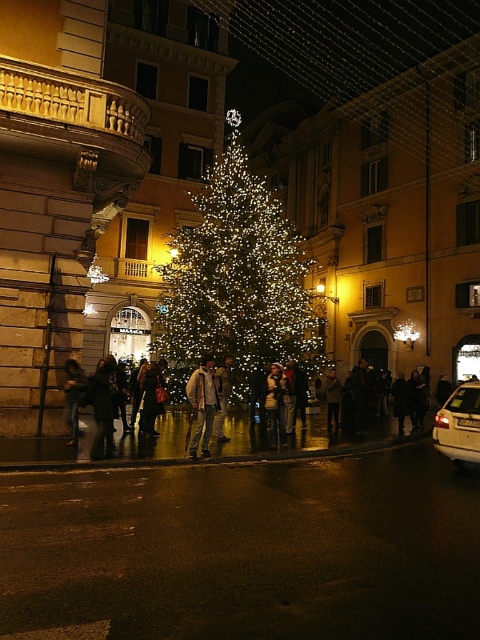
Does point (282, 230) come closer to viewer compared to point (67, 412)?

No.

Which is in front, point (227, 337) or point (78, 422)?

Point (78, 422)

Is point (224, 291) more distant than point (73, 436)?

Yes, point (224, 291) is behind point (73, 436).

The height and width of the screenshot is (640, 480). I want to click on illuminated glass christmas tree at center, so click(238, 280).

Based on the photo, is khaki cotton jacket at center wider than leather jacket at center?

No, khaki cotton jacket at center is not wider than leather jacket at center.

Between khaki cotton jacket at center and leather jacket at center, which one has less height?

khaki cotton jacket at center

Is point (203, 451) positioned in front of point (269, 416)?

Yes, it is in front of point (269, 416).

Identify the location of khaki cotton jacket at center. The height and width of the screenshot is (640, 480). (203, 403).

Is shiny metallic crowd at center smaller than metallic silver car at lower right?

Incorrect, shiny metallic crowd at center is not smaller in size than metallic silver car at lower right.

Between point (240, 410) and point (456, 420), which one is positioned behind?

Point (240, 410)

Describe the element at coordinates (344, 433) in the screenshot. I see `shiny metallic crowd at center` at that location.

This screenshot has height=640, width=480. What are the coordinates of `shiny metallic crowd at center` in the screenshot? It's located at (344, 433).